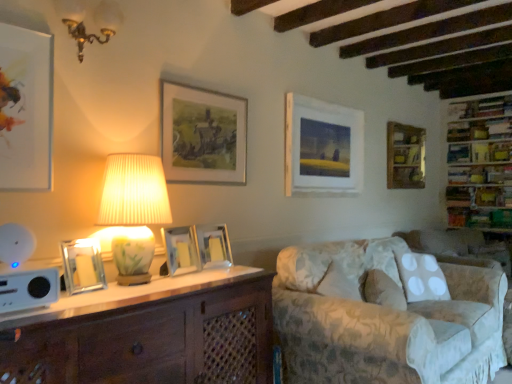
Where is `free space above white matte picture frame at center, the 6th picture frame in the front-to-back sequence (from a real-world perspective)`? The height and width of the screenshot is (384, 512). free space above white matte picture frame at center, the 6th picture frame in the front-to-back sequence (from a real-world perspective) is located at coordinates (323, 101).